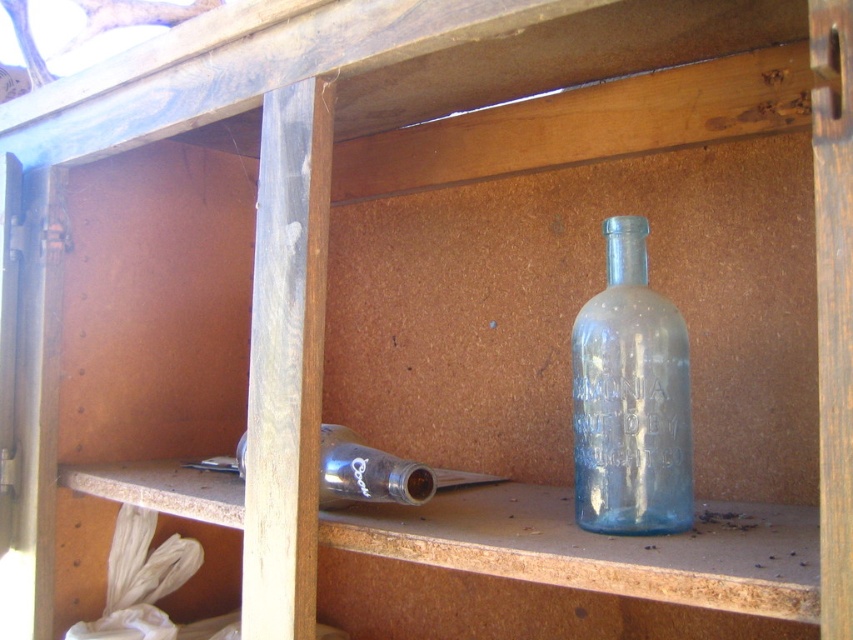
Question: Considering the relative positions of blue glass bottle at center and transparent glass bottle at lower left in the image provided, where is blue glass bottle at center located with respect to transparent glass bottle at lower left?

Choices:
 (A) right
 (B) left

Answer: (A)

Question: Which point is farther to the camera?

Choices:
 (A) (403, 492)
 (B) (682, 348)

Answer: (A)

Question: Can you confirm if blue glass bottle at center is bigger than transparent glass bottle at lower left?

Choices:
 (A) yes
 (B) no

Answer: (B)

Question: In this image, where is blue glass bottle at center located relative to transparent glass bottle at lower left?

Choices:
 (A) below
 (B) above

Answer: (B)